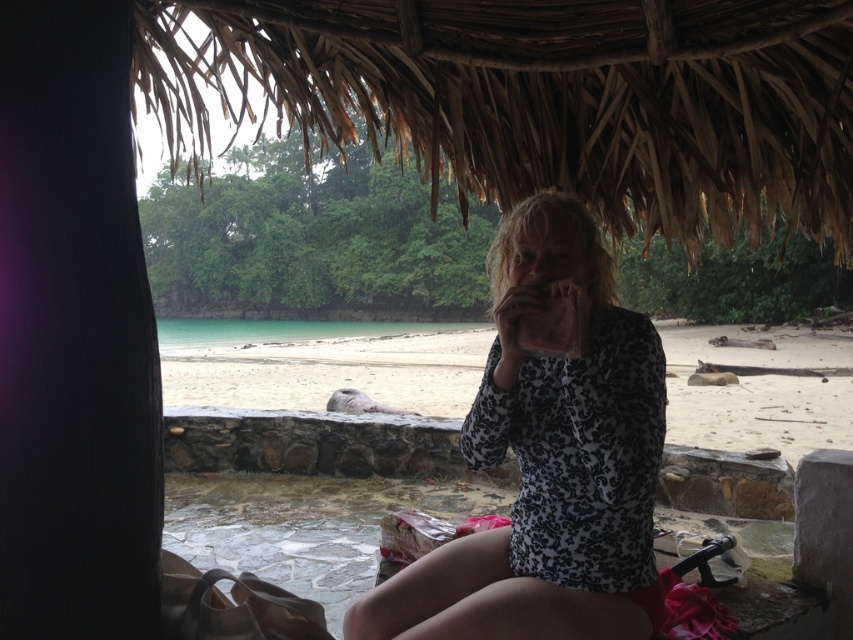
Does white leopard print dress at center have a greater width compared to beige sand at center?

No, white leopard print dress at center is not wider than beige sand at center.

Can you confirm if white leopard print dress at center is bigger than beige sand at center?

No, white leopard print dress at center is not bigger than beige sand at center.

Is point (548, 637) positioned in front of point (677, 355)?

Yes, it is in front of point (677, 355).

The height and width of the screenshot is (640, 853). Find the location of `white leopard print dress at center`. white leopard print dress at center is located at coordinates (549, 461).